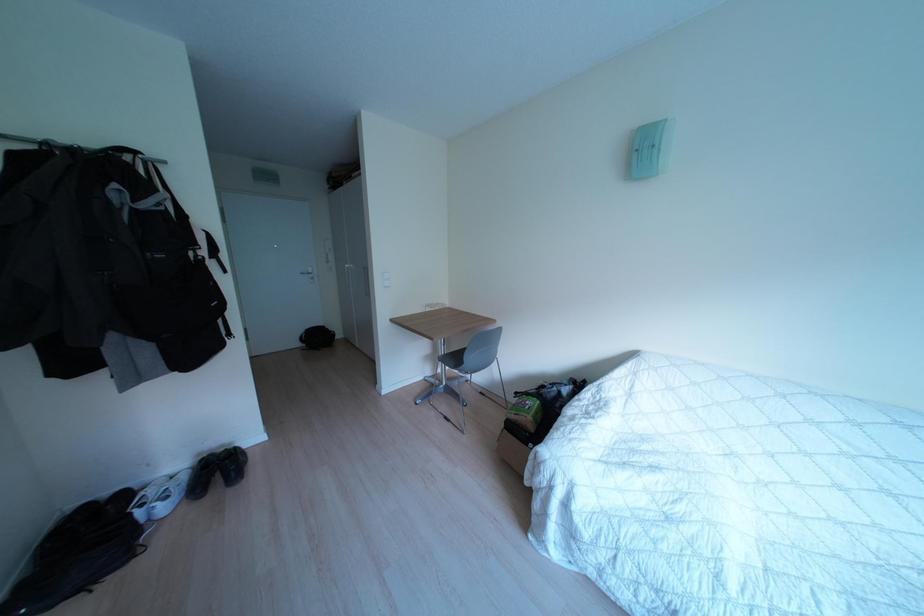
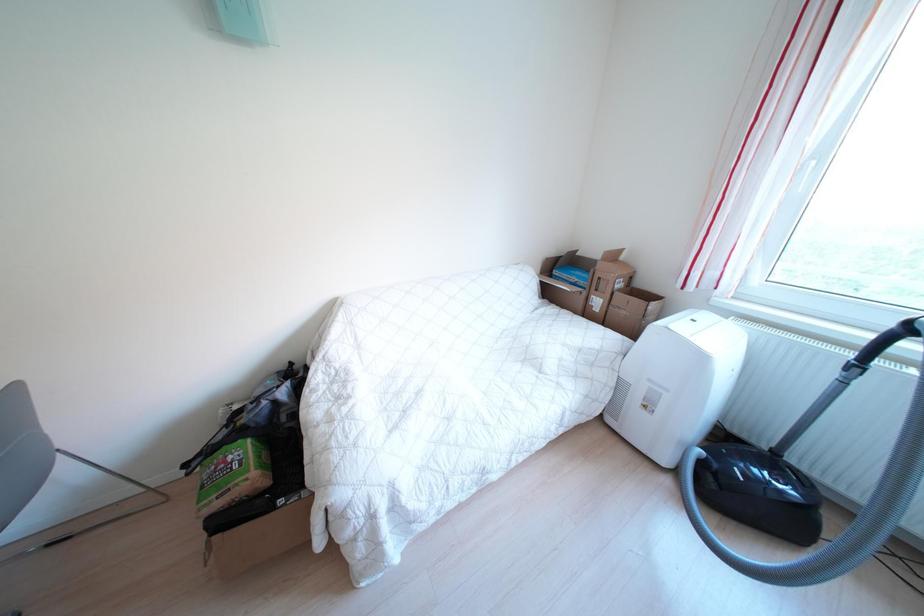
In the scene shown: Based on the continuous images, in which direction is the camera rotating?

The camera's rotation is toward right-down.